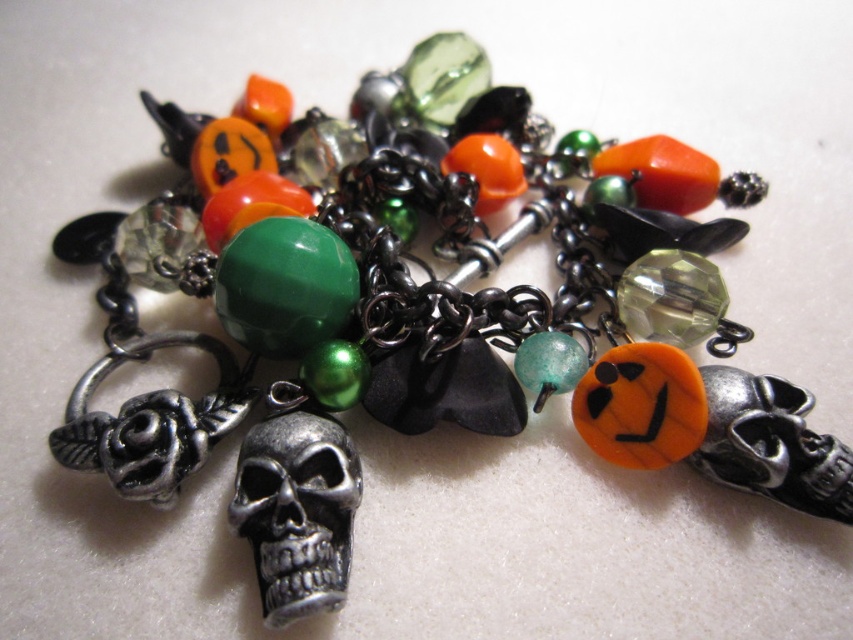
Looking at the Halloween charm bracelet, which object is taller between the metallic skull at center and the transparent faceted bead at center?

The metallic skull at center is taller than the transparent faceted bead at center.

Looking at the Halloween charm bracelet, which object is taller between the transparent faceted bead at center and the translucent green glass bead at center?

The transparent faceted bead at center is taller than the translucent green glass bead at center.